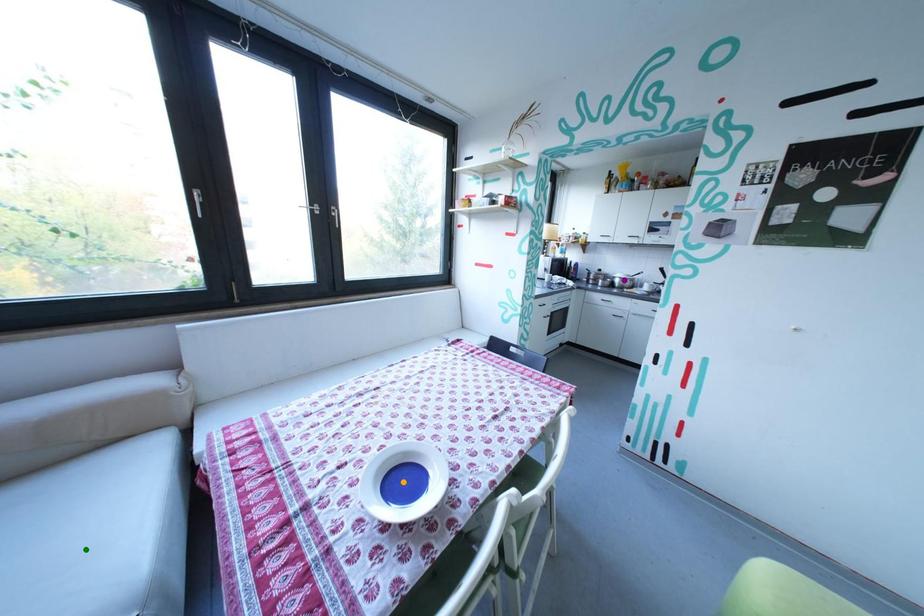
Order these from nearest to farthest:
1. green point
2. orange point
3. purple point

green point
orange point
purple point